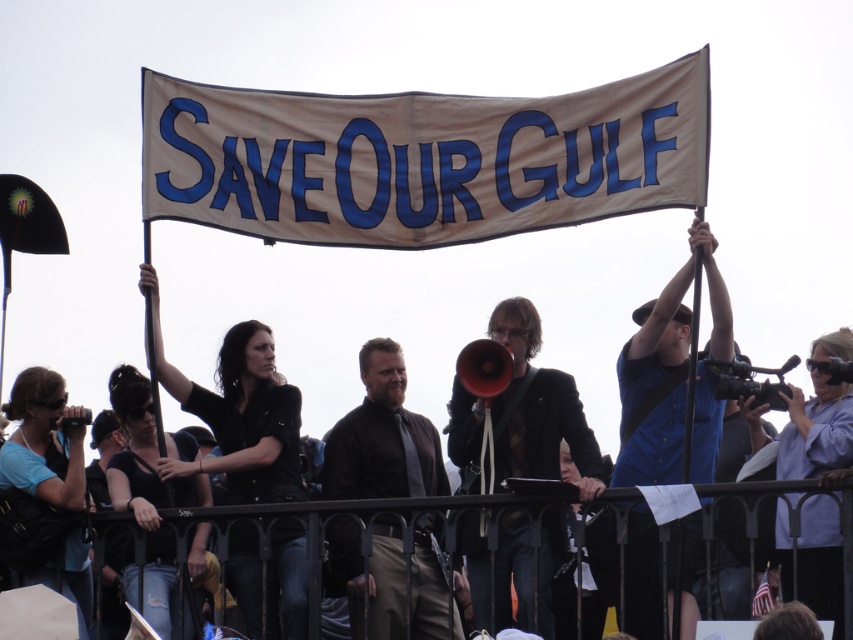
Does brown leather jacket at center have a lesser height compared to black leather jacket at center?

Indeed, brown leather jacket at center has a lesser height compared to black leather jacket at center.

Does brown leather jacket at center have a greater height compared to black leather jacket at center?

No.

You are a GUI agent. You are given a task and a screenshot of the screen. Output one action in this format:
    pyautogui.click(x=<x>, y=<y>)
    Task: Click on the brown leather jacket at center
    
    Given the screenshot: What is the action you would take?
    [381, 436]

From the picture: Which of these two, black leather jacket at center or blue cotton shirt at upper center, stands shorter?

Standing shorter between the two is black leather jacket at center.

Does black leather jacket at center have a lesser width compared to blue cotton shirt at upper center?

A: In fact, black leather jacket at center might be wider than blue cotton shirt at upper center.

Is point (276, 499) positioned behind point (635, 314)?

That is False.

Locate an element on the screen. black leather jacket at center is located at coordinates (238, 412).

Can you confirm if matte black jacket at center is bigger than black leather jacket at lower left?

Yes, matte black jacket at center is bigger than black leather jacket at lower left.

Does point (554, 474) come closer to viewer compared to point (143, 595)?

No.

Which is behind, point (561, 374) or point (126, 580)?

Point (561, 374)

The height and width of the screenshot is (640, 853). I want to click on matte black jacket at center, so click(x=535, y=404).